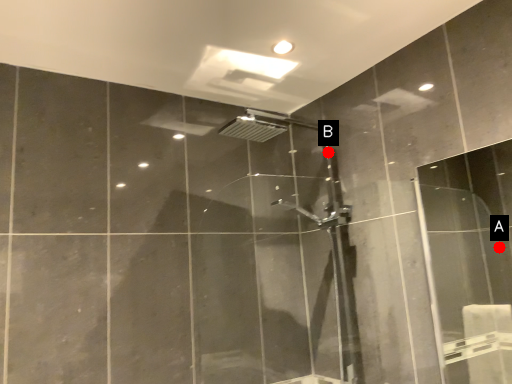
Question: Two points are circled on the image, labeled by A and B beside each circle. Among these points, which one is farthest from the camera?

Choices:
 (A) A is further
 (B) B is further

Answer: (A)